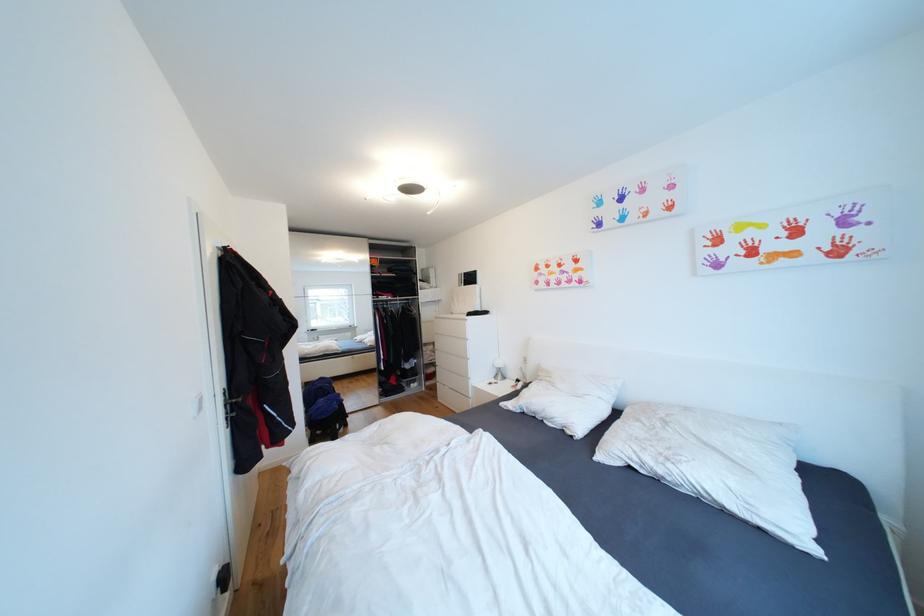
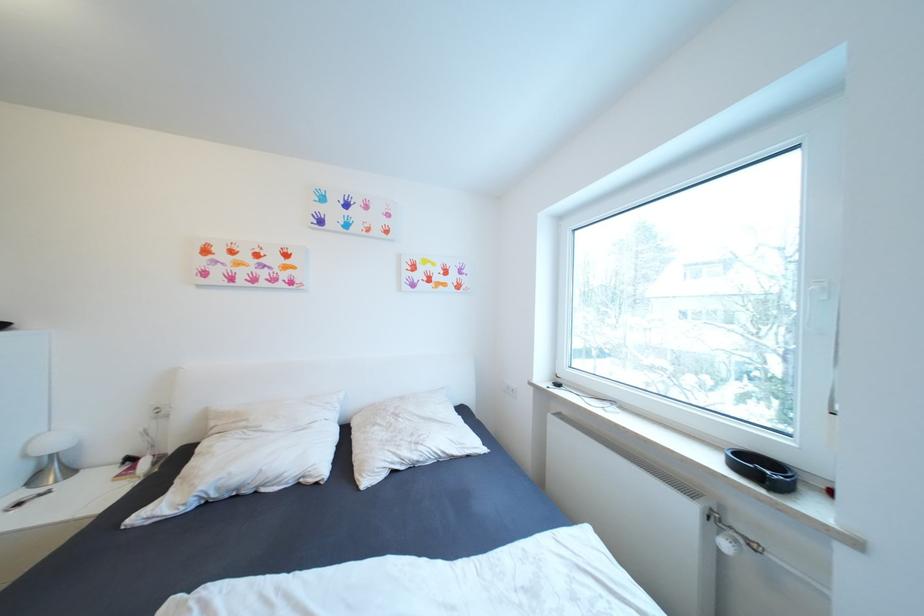
Find the pixel in the second image that matches the point at 506,365 in the first image.

(63, 445)